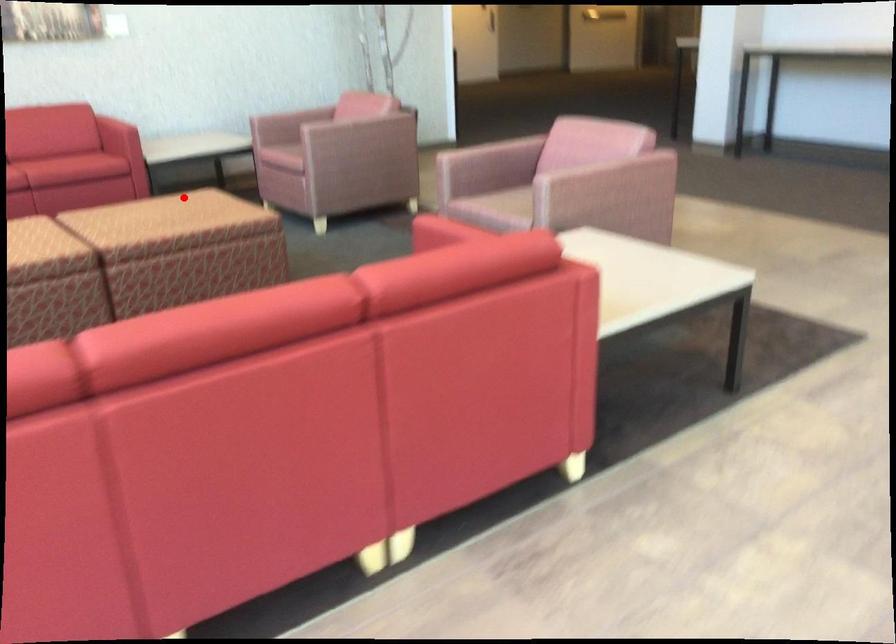
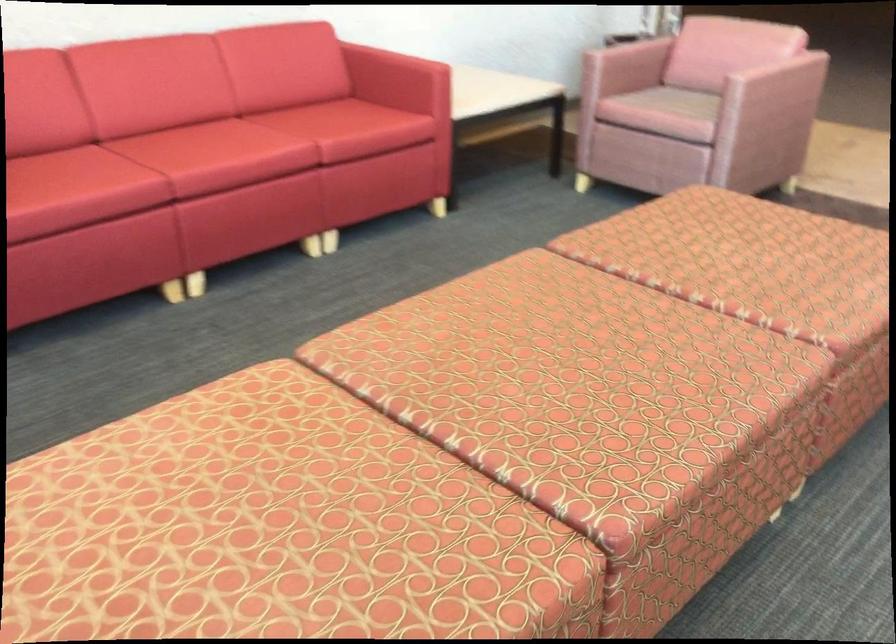
Question: A red point is marked in image1. In image2, is the corresponding 3D point closer to the camera or farther? Reply with the corresponding letter.

Choices:
 (A) The corresponding 3D point is closer.
 (B) The corresponding 3D point is farther.

Answer: (A)